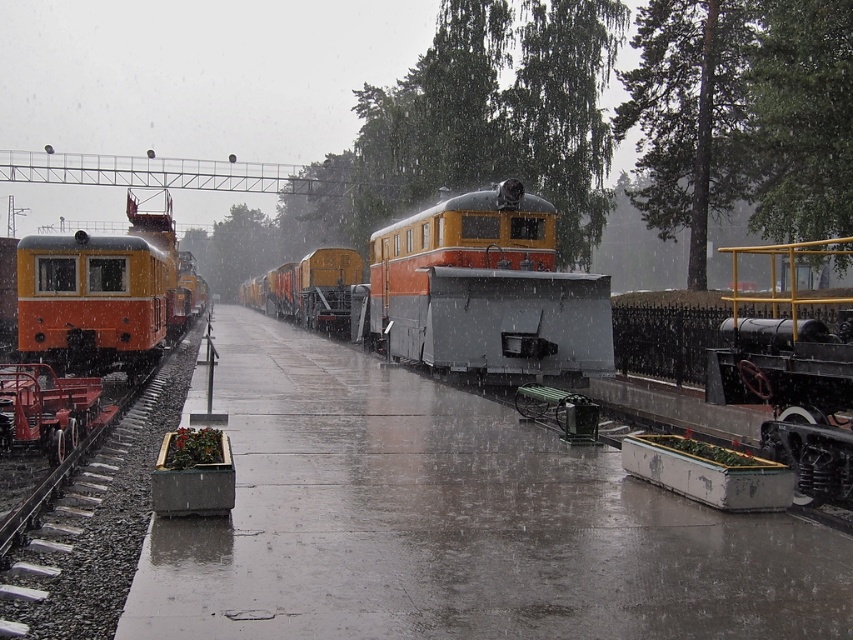
You are a visitor at the train station and want to take a photo of both the orange matte train at center and the orange matte train at left. Since you have a wide angle lens, will you be able to capture both trains in a single frame if you stand at the walkway? Please explain your reasoning based on their positions.

The orange matte train at center is above the orange matte train at left, meaning they are positioned at different heights. Since you are standing on the walkway, which is parallel to the tracks, and the trains are stacked vertically, you should be able to capture both in a single frame as they are not overlapping horizontally.

You are standing at the entrance of the station and want to locate the orange matte train at center. According to the coordinate system where the bottom left corner is the origin, can you determine its position?

The orange matte train at center is located at coordinate point 0.458 on the x axis and 0.542 on the y axis.

You are standing at the railway station and want to walk from point A to point B. Point A is at coordinate point (476, 195) and point B is at coordinate point (125, 262). Which point is closer to you when you start walking?

Point A at coordinate point (476, 195) is closer to you because it is further to the viewer than point B at coordinate point (125, 262).